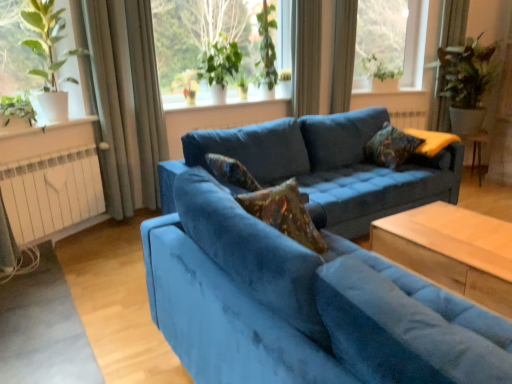
At what (x,y) coordinates should I click in order to perform the action: click on empty space that is ontop of white metallic radiator at lower left. Please return your answer as a coordinate pair (x, y). Looking at the image, I should click on (49, 153).